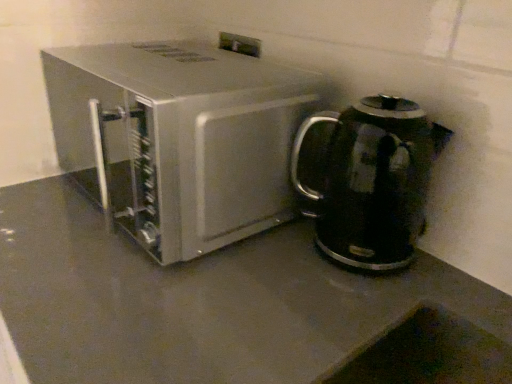
Question: Which direction should I rotate to look at satin silver microwave at center, acting as the second kitchen appliance starting from the right, — up or down?

Choices:
 (A) up
 (B) down

Answer: (A)

Question: Is satin silver microwave at center, the first kitchen appliance from the left, at the right side of black glossy electric kettle at right, which is the second kitchen appliance from left to right?

Choices:
 (A) yes
 (B) no

Answer: (B)

Question: Considering the relative sizes of satin silver microwave at center, the first kitchen appliance from the left, and black glossy electric kettle at right, which is the second kitchen appliance from left to right, in the image provided, is satin silver microwave at center, the first kitchen appliance from the left, thinner than black glossy electric kettle at right, which is the second kitchen appliance from left to right,?

Choices:
 (A) yes
 (B) no

Answer: (B)

Question: Is satin silver microwave at center, the first kitchen appliance from the left, smaller than black glossy electric kettle at right, which is the second kitchen appliance from left to right?

Choices:
 (A) no
 (B) yes

Answer: (A)

Question: From a real-world perspective, is satin silver microwave at center, acting as the second kitchen appliance starting from the right, physically below black glossy electric kettle at right, which appears as the first kitchen appliance when viewed from the right?

Choices:
 (A) no
 (B) yes

Answer: (A)

Question: From a real-world perspective, is satin silver microwave at center, acting as the second kitchen appliance starting from the right, located higher than black glossy electric kettle at right, which is the second kitchen appliance from left to right?

Choices:
 (A) yes
 (B) no

Answer: (A)

Question: Does satin silver microwave at center, the first kitchen appliance from the left, have a greater height compared to black glossy electric kettle at right, which appears as the first kitchen appliance when viewed from the right?

Choices:
 (A) no
 (B) yes

Answer: (B)

Question: Is black glossy electric kettle at right, which appears as the first kitchen appliance when viewed from the right, oriented towards satin silver microwave at center, acting as the second kitchen appliance starting from the right?

Choices:
 (A) no
 (B) yes

Answer: (A)

Question: Is black glossy electric kettle at right, which is the second kitchen appliance from left to right, at the left side of satin silver microwave at center, acting as the second kitchen appliance starting from the right?

Choices:
 (A) no
 (B) yes

Answer: (A)

Question: Does black glossy electric kettle at right, which is the second kitchen appliance from left to right, appear on the right side of satin silver microwave at center, acting as the second kitchen appliance starting from the right?

Choices:
 (A) no
 (B) yes

Answer: (B)

Question: Is black glossy electric kettle at right, which appears as the first kitchen appliance when viewed from the right, further to camera compared to satin silver microwave at center, the first kitchen appliance from the left?

Choices:
 (A) yes
 (B) no

Answer: (A)

Question: From the image's perspective, is black glossy electric kettle at right, which is the second kitchen appliance from left to right, under satin silver microwave at center, acting as the second kitchen appliance starting from the right?

Choices:
 (A) no
 (B) yes

Answer: (B)

Question: Are black glossy electric kettle at right, which appears as the first kitchen appliance when viewed from the right, and satin silver microwave at center, the first kitchen appliance from the left, making contact?

Choices:
 (A) no
 (B) yes

Answer: (A)

Question: In the image, is black glossy electric kettle at right, which is the second kitchen appliance from left to right, on the left side or the right side of satin silver microwave at center, acting as the second kitchen appliance starting from the right?

Choices:
 (A) right
 (B) left

Answer: (A)